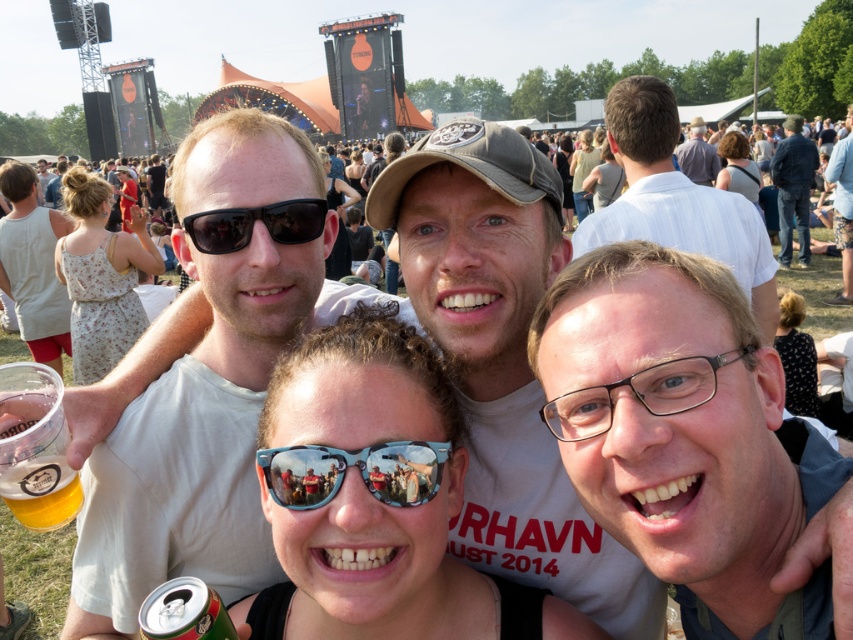
Is transparent plastic glasses at center bigger than dark blue jeans at right?

No.

Who is more distant from viewer, (566, 401) or (778, 195)?

The point (778, 195) is more distant.

Where is `transparent plastic glasses at center`? The image size is (853, 640). transparent plastic glasses at center is located at coordinates (637, 394).

Find the location of `transparent plastic glasses at center`. transparent plastic glasses at center is located at coordinates (637, 394).

Does transparent plastic glasses at center have a smaller size compared to matte white t-shirt at upper center?

Indeed, transparent plastic glasses at center has a smaller size compared to matte white t-shirt at upper center.

Measure the distance between point (698,360) and camera.

Point (698,360) is 21.30 meters away from camera.

Find the location of `transparent plastic glasses at center`. transparent plastic glasses at center is located at coordinates (637, 394).

Which is more to the left, white t-shirt at center or transparent plastic glasses at center?

white t-shirt at center is more to the left.

Is white t-shirt at center positioned before transparent plastic glasses at center?

No, it is not.

In order to click on white t-shirt at center in this screenshot , I will do `click(194, 444)`.